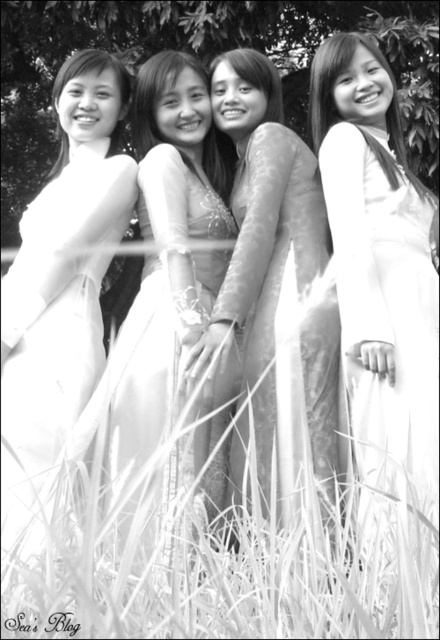
Question: Is white soft grass at center thinner than white lace dress at center?

Choices:
 (A) no
 (B) yes

Answer: (A)

Question: Which point is closer to the camera?

Choices:
 (A) (244, 372)
 (B) (132, 348)

Answer: (A)

Question: Among these points, which one is nearest to the camera?

Choices:
 (A) (264, 115)
 (B) (85, 189)
 (C) (373, 106)
 (D) (157, 497)

Answer: (D)

Question: Does white soft grass at center have a smaller size compared to white satin ao dai at center?

Choices:
 (A) no
 (B) yes

Answer: (B)

Question: Among these points, which one is farthest from the camera?

Choices:
 (A) (257, 344)
 (B) (200, 436)
 (C) (330, 547)

Answer: (A)

Question: From the image, what is the correct spatial relationship of white soft grass at center in relation to white satin ao dai at center?

Choices:
 (A) below
 (B) above

Answer: (A)